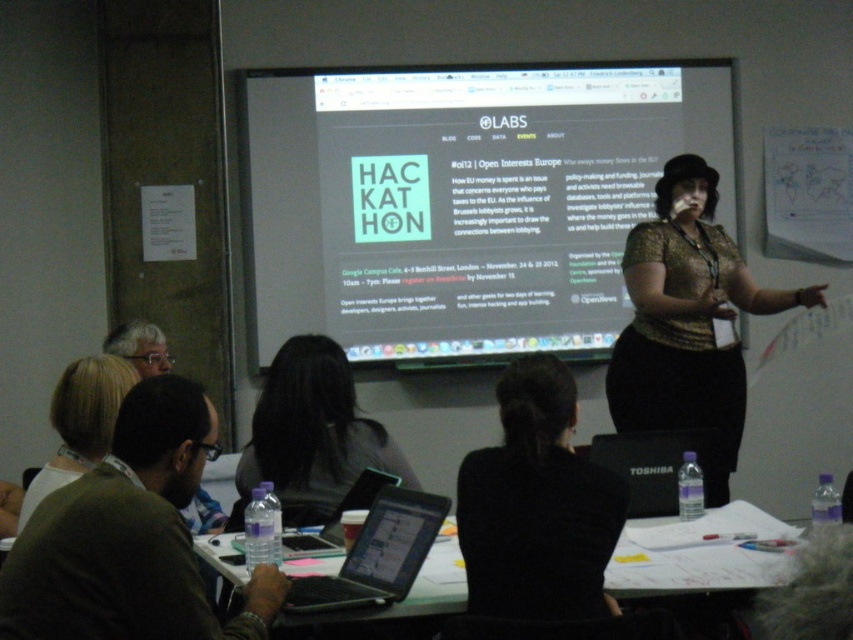
Is white glossy projection screen at upper center taller than blonde hair at lower left?

Yes.

Based on the photo, can you confirm if white glossy projection screen at upper center is positioned to the right of blonde hair at lower left?

Indeed, white glossy projection screen at upper center is positioned on the right side of blonde hair at lower left.

At what (x,y) coordinates should I click in order to perform the action: click on white glossy projection screen at upper center. Please return your answer as a coordinate pair (x, y). This screenshot has width=853, height=640. Looking at the image, I should click on (463, 202).

The height and width of the screenshot is (640, 853). I want to click on white glossy projection screen at upper center, so click(463, 202).

Does white glossy projection screen at upper center appear under black fabric hair at center?

Actually, white glossy projection screen at upper center is above black fabric hair at center.

Who is shorter, white glossy projection screen at upper center or black fabric hair at center?

black fabric hair at center is shorter.

Between point (395, 225) and point (498, 458), which one is positioned in front?

Point (498, 458) is more forward.

The height and width of the screenshot is (640, 853). I want to click on white glossy projection screen at upper center, so click(x=463, y=202).

Who is lower down, dark brown hair at center or black glossy laptop at center?

black glossy laptop at center

Find the location of a particular element. The height and width of the screenshot is (640, 853). dark brown hair at center is located at coordinates click(311, 435).

Identify the location of dark brown hair at center. The image size is (853, 640). (311, 435).